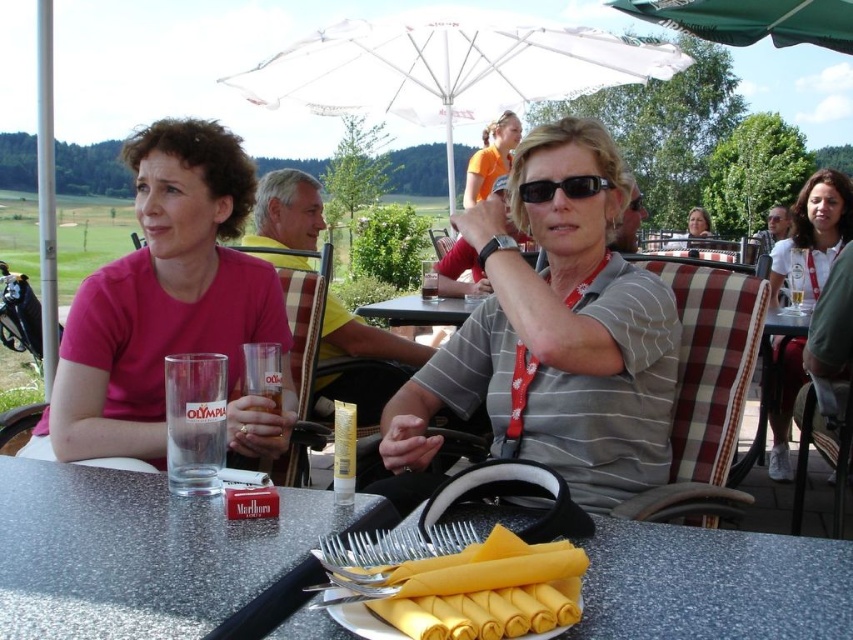
Question: Can you confirm if matte pink shirt at left is smaller than black plastic sunglasses at center?

Choices:
 (A) yes
 (B) no

Answer: (B)

Question: Based on their relative distances, which object is farther from the translucent glass at table center?

Choices:
 (A) yellow fabric napkin at lower center
 (B) speckled laminate table at center
 (C) white fabric umbrella at upper center
 (D) matte gray shirt at center

Answer: (D)

Question: Is granite gray picnic table at center further to the viewer compared to black plastic table at center?

Choices:
 (A) no
 (B) yes

Answer: (A)

Question: Can you confirm if white lanyard at upper right is positioned above translucent glass at table center?

Choices:
 (A) no
 (B) yes

Answer: (A)

Question: Which point is closer to the camera taking this photo?

Choices:
 (A) (675, 246)
 (B) (271, 394)
 (C) (410, 310)

Answer: (B)

Question: Which of the following is the closest to the observer?

Choices:
 (A) (390, 579)
 (B) (178, 520)
 (C) (689, 241)

Answer: (A)